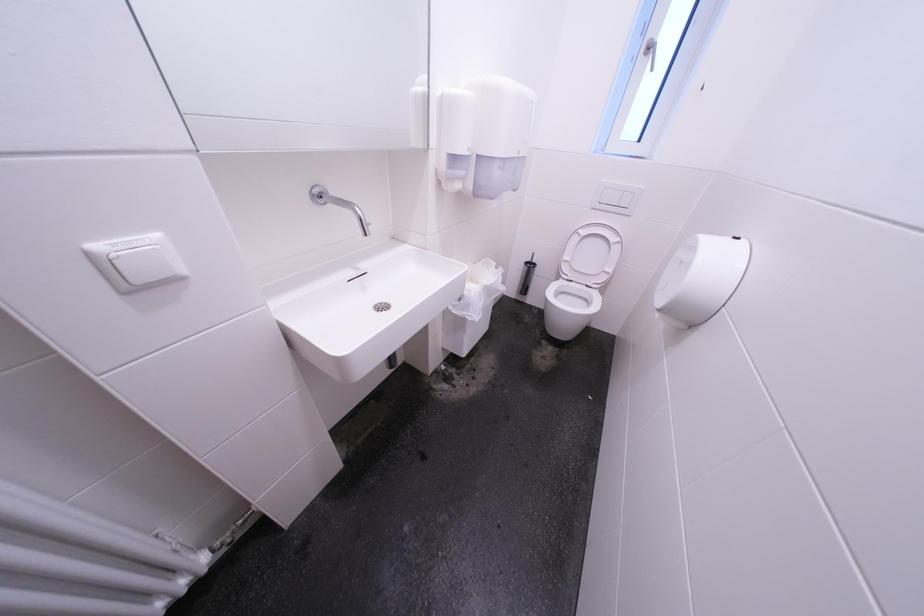
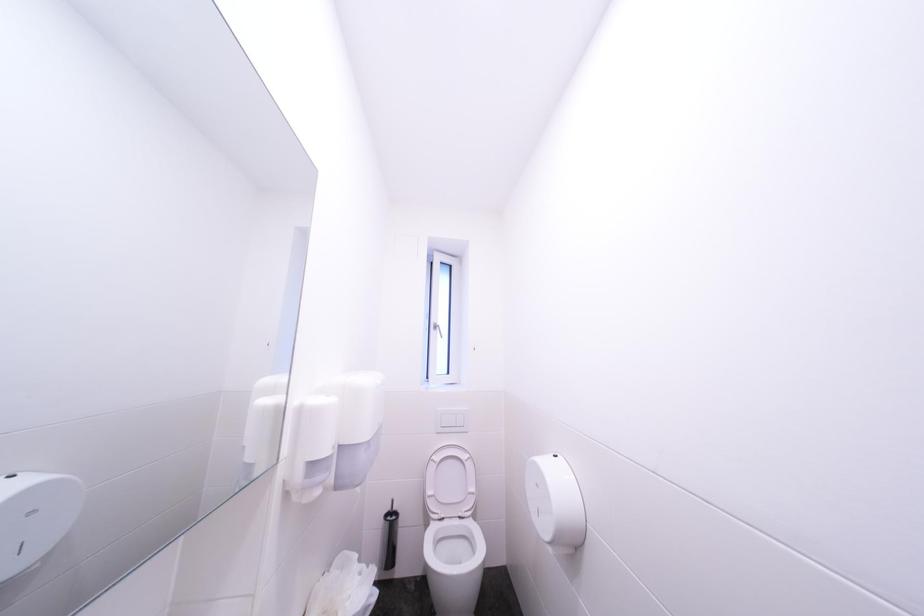
How did the camera likely rotate?

The camera rotated toward right-up.